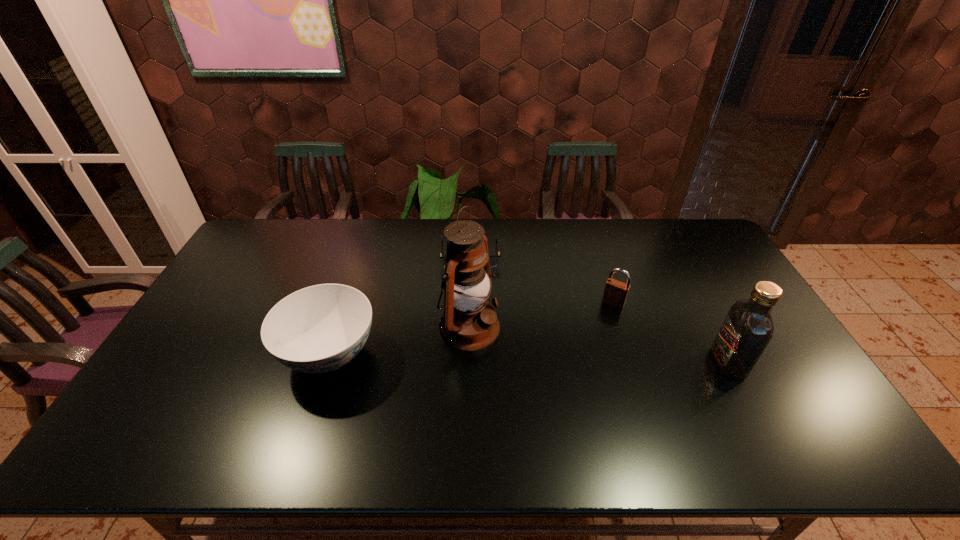
At what (x,y) coordinates should I click in order to perform the action: click on object positioned at the far edge. Please return your answer as a coordinate pair (x, y). The height and width of the screenshot is (540, 960). Looking at the image, I should click on (493, 260).

The height and width of the screenshot is (540, 960). I want to click on object located in the near edge section of the desktop, so coord(317,329).

Identify the location of object that is at the right edge. This screenshot has width=960, height=540. (747, 329).

Image resolution: width=960 pixels, height=540 pixels. Identify the location of free space at the far edge. (380, 248).

This screenshot has height=540, width=960. Find the location of `vacant space at the near edge`. vacant space at the near edge is located at coordinates [340, 394].

This screenshot has width=960, height=540. What are the coordinates of `free space at the left edge of the desktop` in the screenshot? It's located at (247, 269).

The image size is (960, 540). What are the coordinates of `free region at the right edge of the desktop` in the screenshot? It's located at (788, 373).

You are a GUI agent. You are given a task and a screenshot of the screen. Output one action in this format:
    pyautogui.click(x=<x>, y=<y>)
    Task: Click on the vacant space at the near left corner of the desktop
    The height and width of the screenshot is (540, 960).
    Given the screenshot: What is the action you would take?
    pyautogui.click(x=140, y=410)

Image resolution: width=960 pixels, height=540 pixels. I want to click on blank area at the far right corner, so click(x=680, y=246).

I want to click on free point between the tallest object and the fourth object from left to right, so click(x=541, y=315).